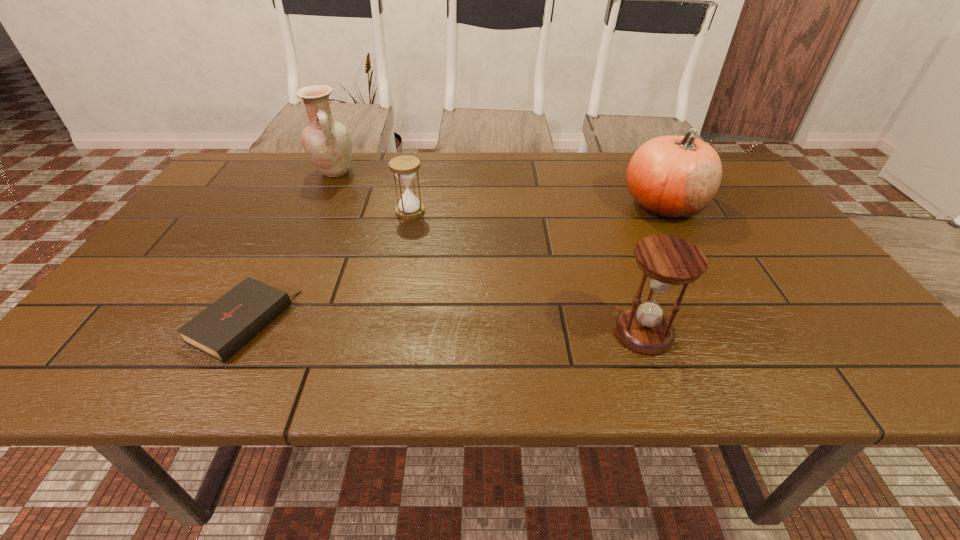
I want to click on vacant space at the left edge of the desktop, so click(129, 320).

Identify the location of free space that is in between the second shortest object and the pottery. The width and height of the screenshot is (960, 540). (372, 192).

Find the location of a particular element. free area in between the Bible and the pumpkin is located at coordinates (453, 264).

The image size is (960, 540). What are the coordinates of `free spot between the second object from right to left and the Bible` in the screenshot? It's located at (443, 328).

Find the location of `free space between the pottery and the third object from left to right`. free space between the pottery and the third object from left to right is located at coordinates (372, 192).

Image resolution: width=960 pixels, height=540 pixels. Identify the location of vacant point located between the fourth tallest object and the fourth object from left to right. pos(527,272).

At what (x,y) coordinates should I click in order to perform the action: click on free space between the shorter hourglass and the right hourglass. Please return your answer as a coordinate pair (x, y). Looking at the image, I should click on (527, 272).

The image size is (960, 540). Identify the location of unoccupied position between the pottery and the shortest object. (288, 248).

In order to click on vacant space that's between the pumpkin and the shortest object in this screenshot , I will do `click(453, 264)`.

You are a GUI agent. You are given a task and a screenshot of the screen. Output one action in this format:
    pyautogui.click(x=<x>, y=<y>)
    Task: Click on the object that stands as the third closest to the Bible
    
    Given the screenshot: What is the action you would take?
    pyautogui.click(x=668, y=261)